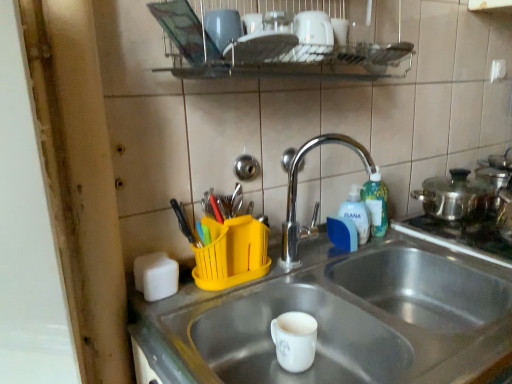
Question: From the image's perspective, is yellow plastic utensil holder at upper center located above or below silver metallic sink at center?

Choices:
 (A) above
 (B) below

Answer: (A)

Question: From a real-world perspective, is yellow plastic utensil holder at upper center physically located above or below silver metallic sink at center?

Choices:
 (A) above
 (B) below

Answer: (A)

Question: Estimate the real-world distances between objects in this image. Which object is farther from the yellow plastic utensil holder at upper center?

Choices:
 (A) metallic wire rack at upper center
 (B) blue plastic bottle at upper right, marked as the 1th bottle in a left-to-right arrangement
 (C) white glossy mug at center
 (D) green translucent bottle at right, which is the second bottle in left-to-right order
 (E) silver metallic sink at center

Answer: (D)

Question: Estimate the real-world distances between objects in this image. Which object is closer to the chrome/metallic faucet at center?

Choices:
 (A) metallic wire rack at upper center
 (B) white glossy mug at center
 (C) green translucent bottle at right, which is the second bottle in left-to-right order
 (D) silver metallic sink at center
 (E) blue plastic bottle at upper right, marked as the 1th bottle in a left-to-right arrangement

Answer: (C)